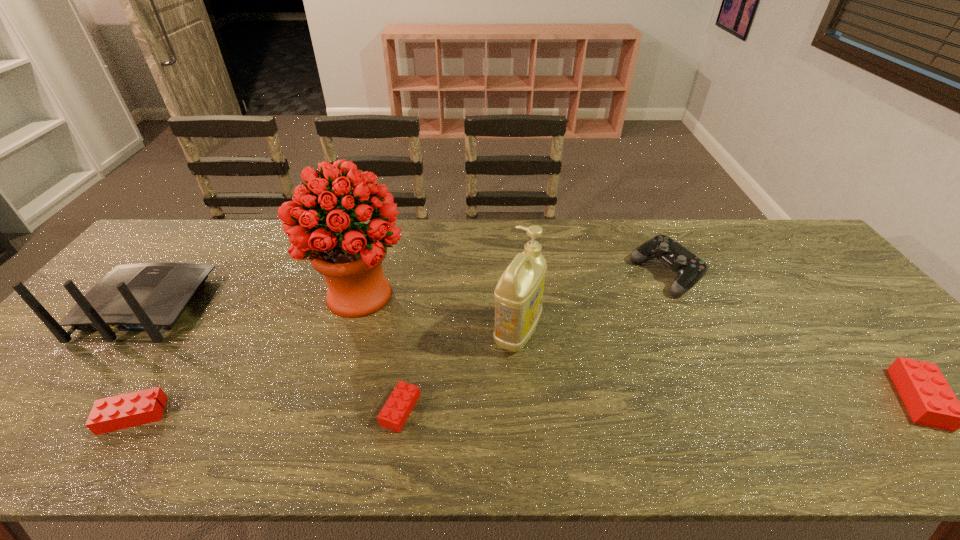
Find the location of `vacant region located 0.350m on the back of the second shortest object`. vacant region located 0.350m on the back of the second shortest object is located at coordinates (214, 293).

The image size is (960, 540). What are the coordinates of `free space located on the right of the shortest Lego` in the screenshot? It's located at (589, 410).

Find the location of a particular element. Image resolution: width=960 pixels, height=540 pixels. vacant space located on the back of the detergent is located at coordinates (511, 252).

The image size is (960, 540). I want to click on free space located 0.070m on the front-facing side of the fifth shortest object, so click(183, 259).

Identify the location of free region located 0.150m on the front-facing side of the fifth shortest object. (196, 244).

This screenshot has width=960, height=540. I want to click on vacant space positioned on the front-facing side of the fifth shortest object, so click(209, 226).

You are a GUI agent. You are given a task and a screenshot of the screen. Output one action in this format:
    pyautogui.click(x=<x>, y=<y>)
    Task: Click on the free spot located 0.350m on the right of the fourth shortest object
    The width and height of the screenshot is (960, 540).
    Given the screenshot: What is the action you would take?
    pyautogui.click(x=814, y=275)

Where is `blank space located on the right of the tallest object`? blank space located on the right of the tallest object is located at coordinates (533, 295).

What are the coordinates of `object at the far edge` in the screenshot? It's located at (689, 268).

What are the coordinates of `object that is positioned at the left edge` in the screenshot? It's located at (151, 297).